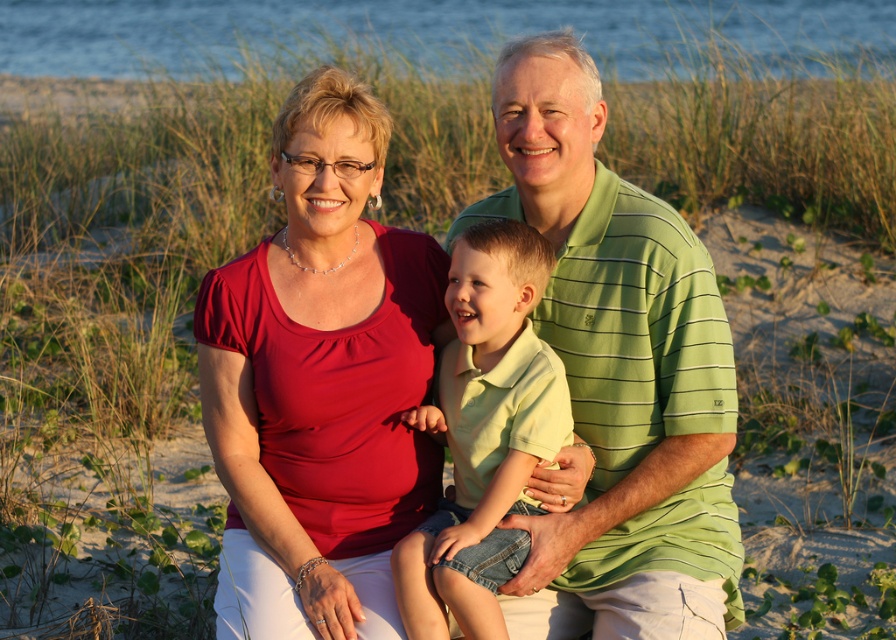
Question: Can you confirm if matte red blouse at center is positioned above green cotton shirt at center?

Choices:
 (A) no
 (B) yes

Answer: (B)

Question: Which of the following is the farthest from the observer?

Choices:
 (A) (472, 468)
 (B) (287, 337)
 (C) (547, 298)

Answer: (C)

Question: Which point appears closest to the camera in this image?

Choices:
 (A) (700, 586)
 (B) (474, 509)

Answer: (B)

Question: Is matte red blouse at center further to the viewer compared to green cotton shirt at center?

Choices:
 (A) no
 (B) yes

Answer: (A)

Question: From the image, what is the correct spatial relationship of matte red blouse at center in relation to green cotton shirt at center?

Choices:
 (A) below
 (B) above

Answer: (B)

Question: Among these objects, which one is farthest from the camera?

Choices:
 (A) green cotton shirt at center
 (B) green striped polo shirt at center
 (C) matte red blouse at center

Answer: (B)